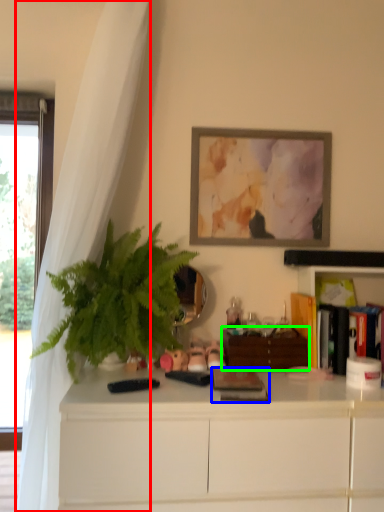
Question: Considering the real-world distances, which object is farthest from curtain (highlighted by a red box)? book (highlighted by a blue box) or file cabinet (highlighted by a green box)?

Choices:
 (A) book
 (B) file cabinet

Answer: (B)